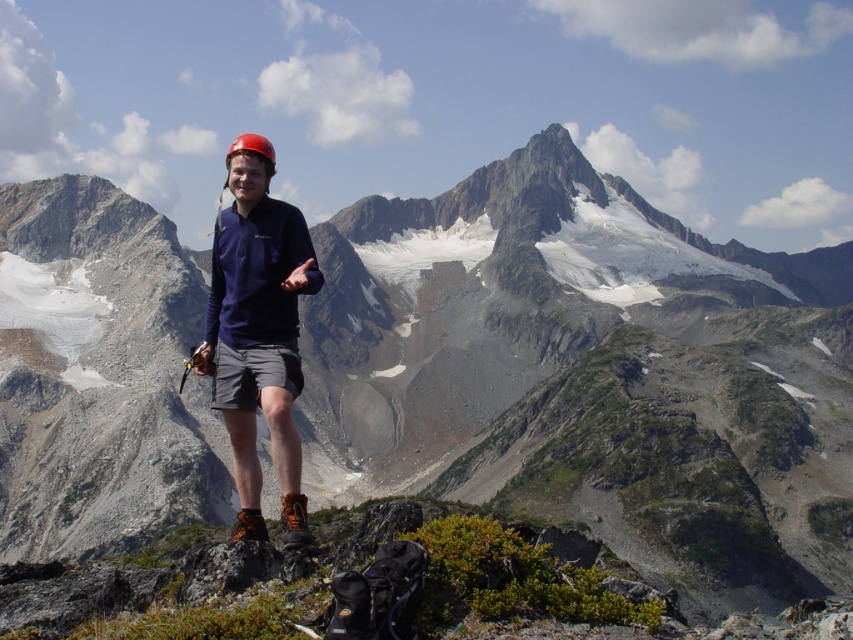
Question: Can you confirm if matte blue shirt at center is thinner than gray fabric shorts at center?

Choices:
 (A) yes
 (B) no

Answer: (B)

Question: Can you confirm if matte blue shirt at center is bigger than gray fabric shorts at center?

Choices:
 (A) no
 (B) yes

Answer: (B)

Question: Does matte blue shirt at center have a greater width compared to gray fabric shorts at center?

Choices:
 (A) yes
 (B) no

Answer: (A)